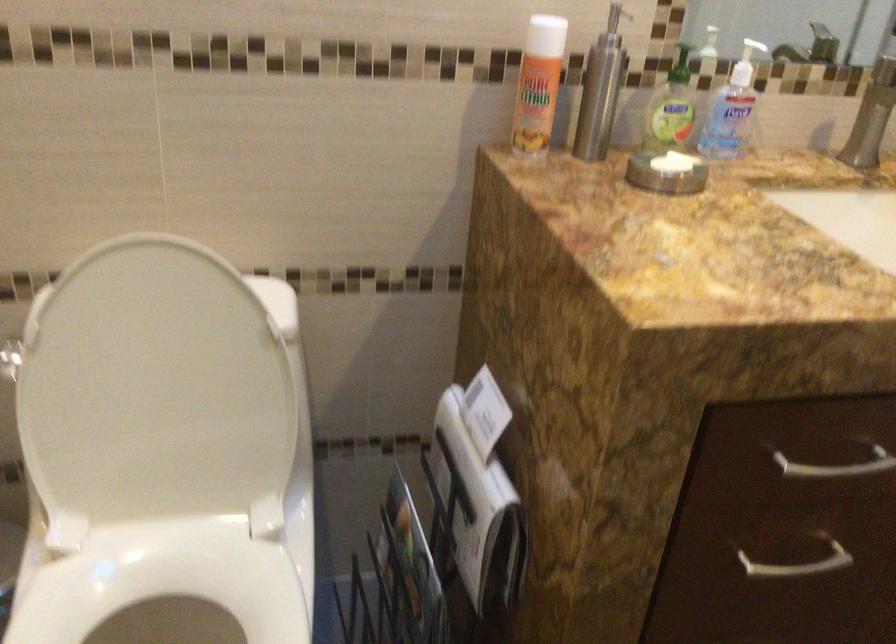
The width and height of the screenshot is (896, 644). I want to click on faucet handle, so tap(872, 116).